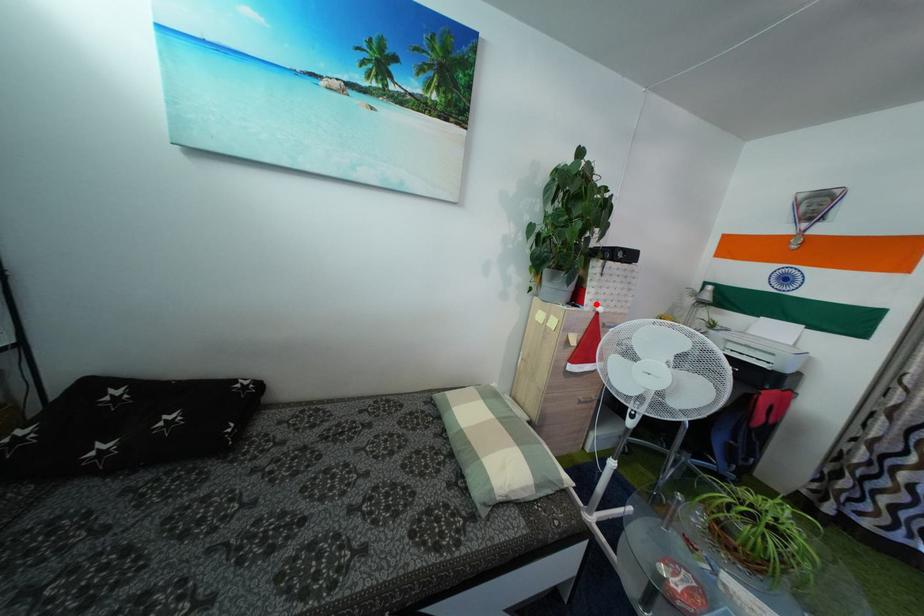
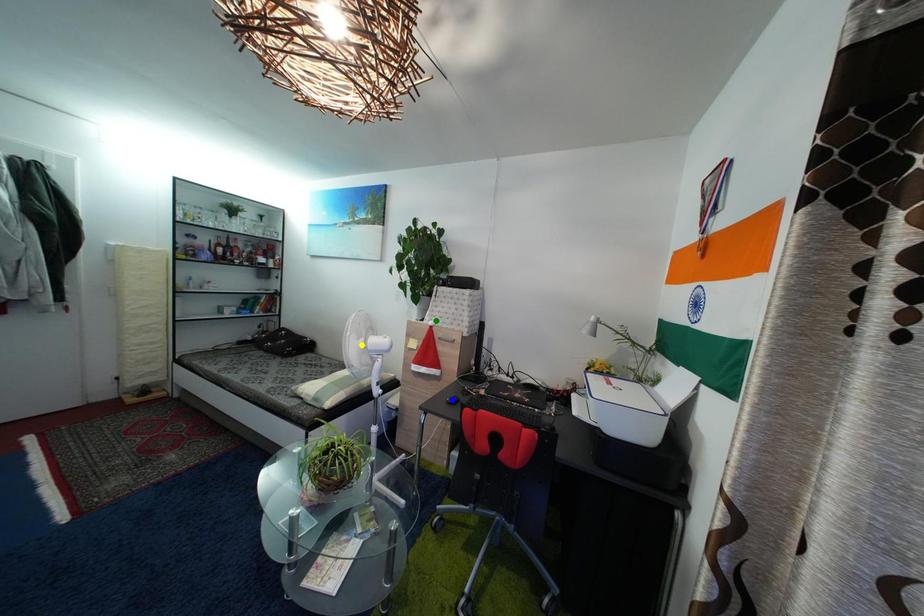
Question: I am providing you with two images of the same scene from different viewpoints. A red point is marked on the first image. You are given multiple points on the second image. Which point in image 2 represents the same 3d spot as the red point in image 1?

Choices:
 (A) yellow point
 (B) blue point
 (C) green point

Answer: (C)